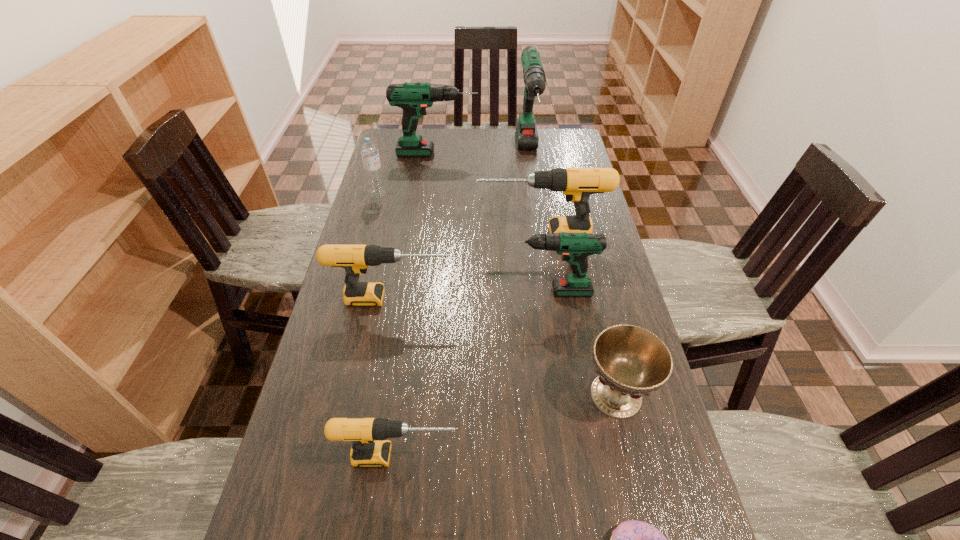
The image size is (960, 540). What are the coordinates of `the nearest drill` in the screenshot? It's located at (370, 449).

I want to click on the eighth farthest object, so click(x=370, y=449).

In order to click on vacant space located 0.230m on the handle side of the biggest green drill in this screenshot , I will do `click(538, 222)`.

The width and height of the screenshot is (960, 540). I want to click on free point located 0.280m on the handle side of the second biggest green drill, so click(547, 154).

This screenshot has height=540, width=960. In order to click on free location located on the handle side of the sixth nearest object in this screenshot , I will do `click(404, 234)`.

Locate an element on the screen. The width and height of the screenshot is (960, 540). free space located 0.340m on the handle side of the sixth nearest object is located at coordinates (373, 234).

Where is `free space located 0.130m on the handle side of the sixth nearest object`? The image size is (960, 540). free space located 0.130m on the handle side of the sixth nearest object is located at coordinates (437, 234).

Locate an element on the screen. free location located on the back of the third farthest object is located at coordinates tap(388, 157).

This screenshot has width=960, height=540. What are the coordinates of `vacant space located on the handle side of the smallest green drill` in the screenshot? It's located at 405,291.

What are the coordinates of `free location located 0.070m on the handle side of the smallest green drill` in the screenshot? It's located at tap(481, 291).